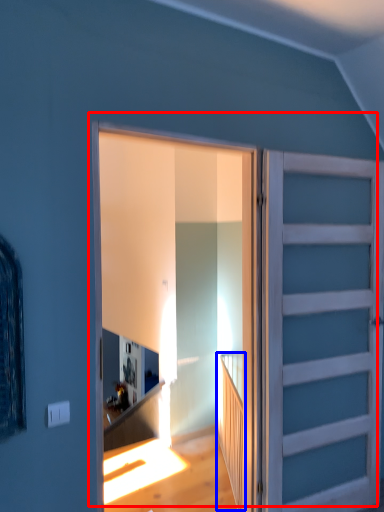
Question: Which of the following is the closest to the observer, door (highlighted by a red box) or stairwell (highlighted by a blue box)?

Choices:
 (A) door
 (B) stairwell

Answer: (A)